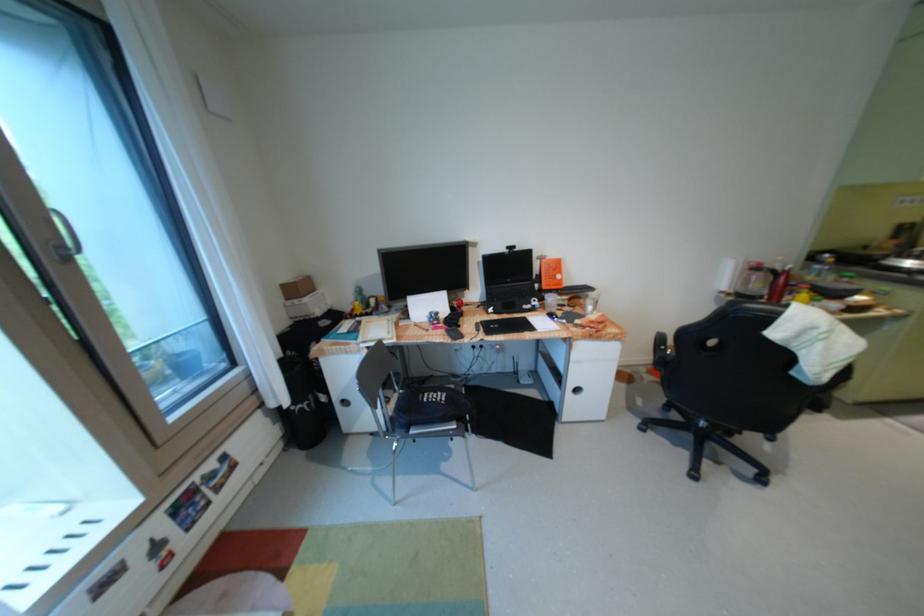
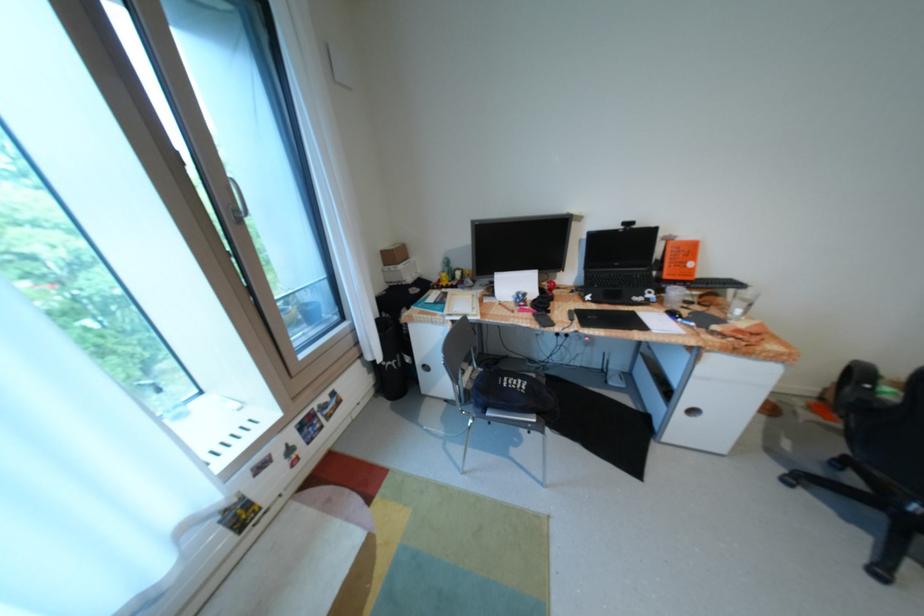
Where in the second image is the point corresponding to point 565,277 from the first image?

(697, 264)